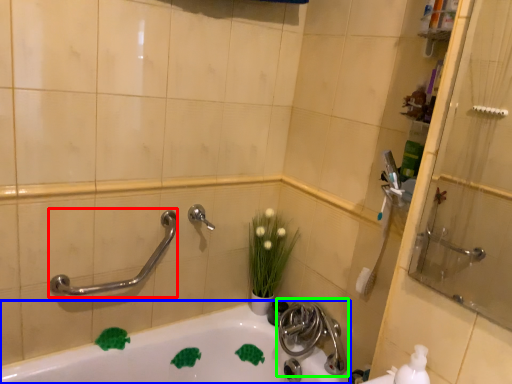
Question: Which object is positioned closest to shower (highlighted by a red box)? Select from bathtub (highlighted by a blue box) and tap (highlighted by a green box).

Choices:
 (A) bathtub
 (B) tap

Answer: (A)